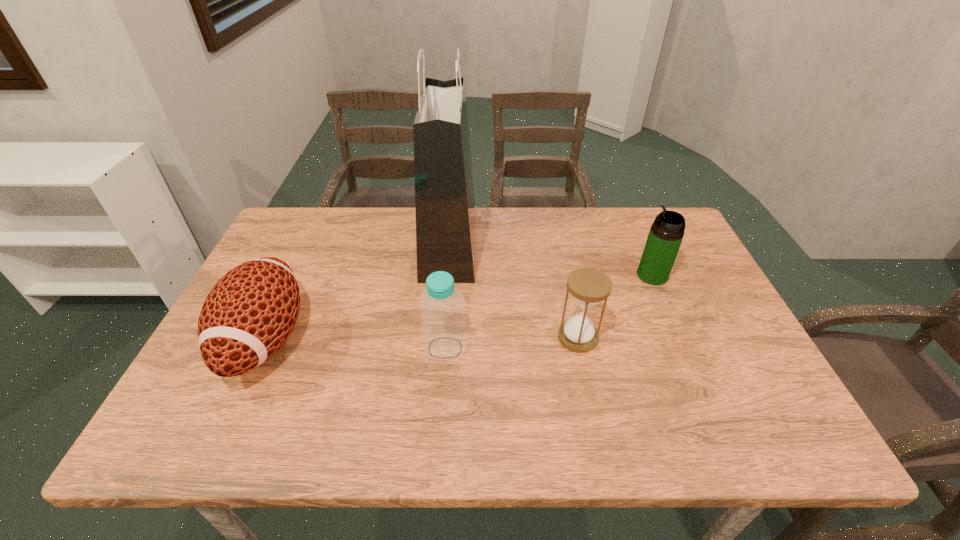
Where is `empty space that is in between the fourth object from left to right and the thermos bottle`? empty space that is in between the fourth object from left to right and the thermos bottle is located at coordinates coord(615,306).

This screenshot has height=540, width=960. What are the coordinates of `free area in between the rightmost object and the hourglass` in the screenshot? It's located at (615, 306).

This screenshot has height=540, width=960. In order to click on free area in between the bottle and the fourth object from left to right in this screenshot , I will do `click(512, 342)`.

You are a GUI agent. You are given a task and a screenshot of the screen. Output one action in this format:
    pyautogui.click(x=<x>, y=<y>)
    Task: Click on the vacant point located between the rightmost object and the second object from right to left
    
    Given the screenshot: What is the action you would take?
    pyautogui.click(x=615, y=306)

You are a GUI agent. You are given a task and a screenshot of the screen. Output one action in this format:
    pyautogui.click(x=<x>, y=<y>)
    Task: Click on the empty location between the thermos bottle and the shopping bag
    This screenshot has height=540, width=960.
    Given the screenshot: What is the action you would take?
    pyautogui.click(x=551, y=259)

Find the location of a particular element. Image resolution: width=960 pixels, height=540 pixels. vacant region between the shopping bag and the thermos bottle is located at coordinates (551, 259).

Identify the location of unoccupied position between the football and the shopping bag. point(357,291).

At what (x,y) coordinates should I click in order to perform the action: click on the fourth closest object to the bottle. Please return your answer as a coordinate pair (x, y). Image resolution: width=960 pixels, height=540 pixels. Looking at the image, I should click on (665, 236).

At what (x,y) coordinates should I click in order to perform the action: click on object that stands as the second closest to the tallest object. Please return your answer as a coordinate pair (x, y). Looking at the image, I should click on (588, 286).

Where is `free location that satisfies the following two spatial constraints: 1. on the front with handles of the tallest object; 2. on the right side of the bottle`? The width and height of the screenshot is (960, 540). free location that satisfies the following two spatial constraints: 1. on the front with handles of the tallest object; 2. on the right side of the bottle is located at coordinates (441, 348).